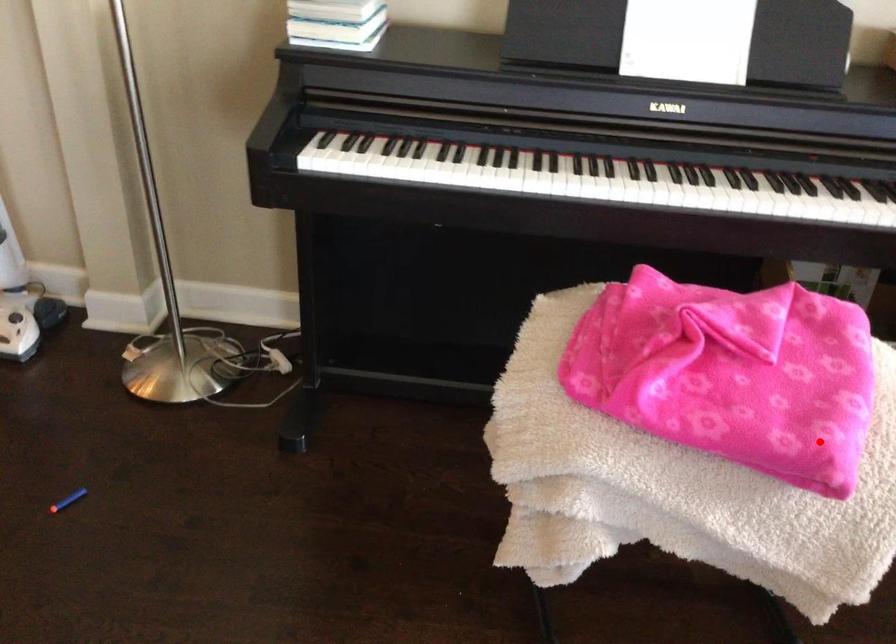
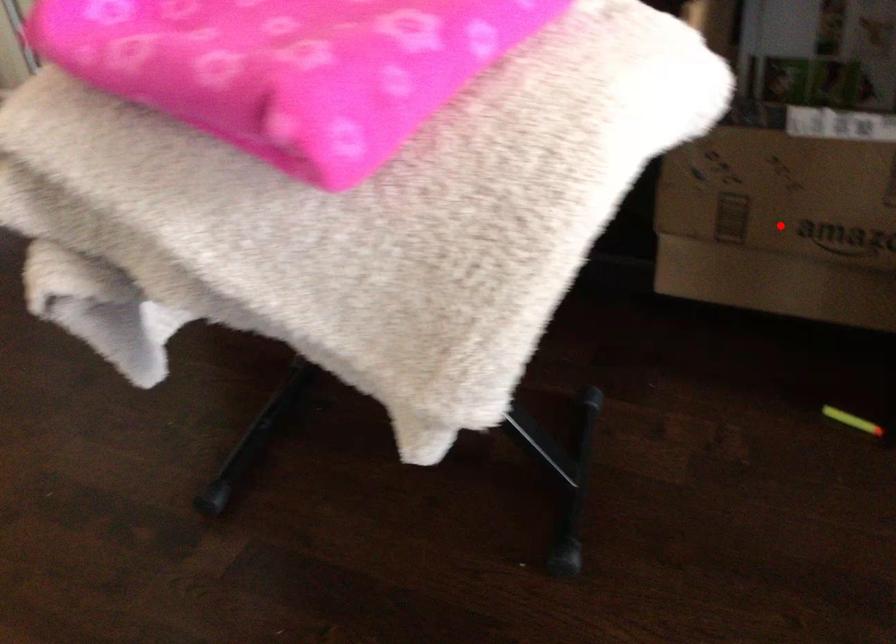
I am providing you with two images of the same scene from different viewpoints. A red point is marked on the first image and another point is marked on the second image. Is the marked point in image1 the same physical position as the marked point in image2?

No